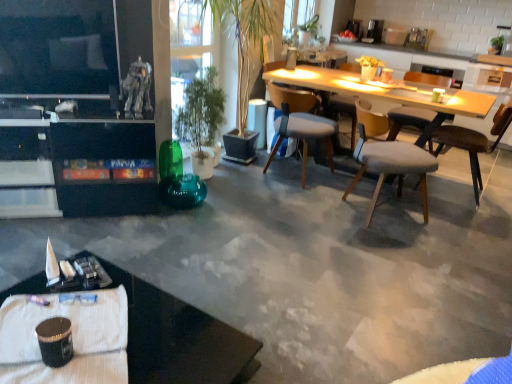
The width and height of the screenshot is (512, 384). I want to click on vacant area to the left of green matte coffee cup at upper right, arranged as the 2th coffee cup when viewed from the back, so click(x=415, y=99).